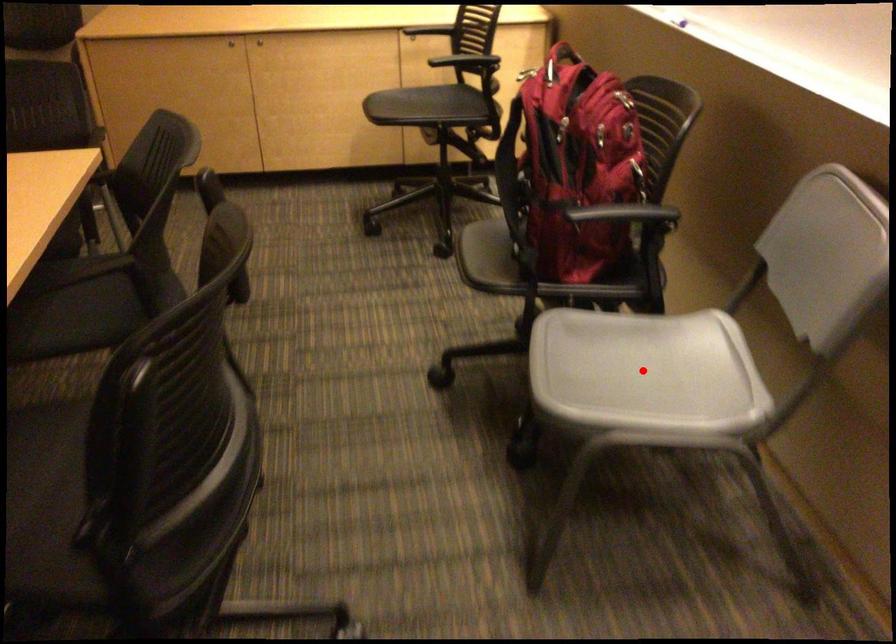
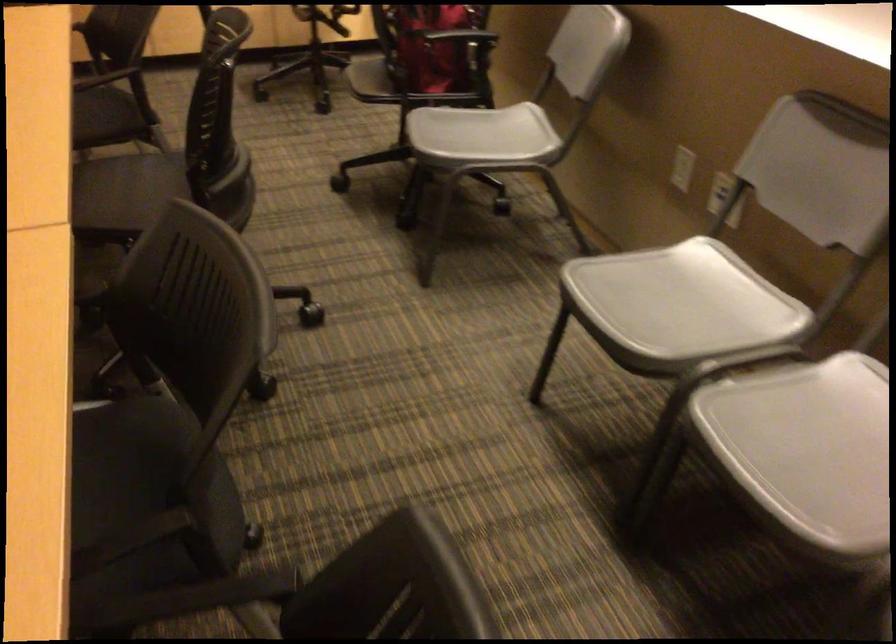
Question: I am providing you with two images of the same scene from different viewpoints. Given a red point in image1, look at the same physical point in image2. Is it:

Choices:
 (A) Closer to the viewpoint
 (B) Farther from the viewpoint

Answer: (B)